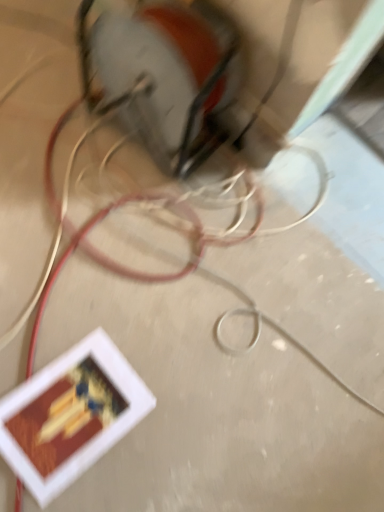
Question: In the image, is matte red wire at lower left positioned in front of or behind metallic silver power plugs and sockets at upper center?

Choices:
 (A) behind
 (B) front

Answer: (B)

Question: Considering the positions of matte red wire at lower left and metallic silver power plugs and sockets at upper center in the image, is matte red wire at lower left taller or shorter than metallic silver power plugs and sockets at upper center?

Choices:
 (A) tall
 (B) short

Answer: (B)

Question: Is point tap(36, 330) closer or farther from the camera than point tap(198, 33)?

Choices:
 (A) closer
 (B) farther

Answer: (B)

Question: In the image, is metallic silver power plugs and sockets at upper center positioned in front of or behind matte red wire at lower left?

Choices:
 (A) front
 (B) behind

Answer: (B)

Question: Based on their sizes in the image, would you say metallic silver power plugs and sockets at upper center is bigger or smaller than matte red wire at lower left?

Choices:
 (A) small
 (B) big

Answer: (A)

Question: Considering the positions of metallic silver power plugs and sockets at upper center and matte red wire at lower left in the image, is metallic silver power plugs and sockets at upper center taller or shorter than matte red wire at lower left?

Choices:
 (A) tall
 (B) short

Answer: (A)

Question: Do you think metallic silver power plugs and sockets at upper center is within matte red wire at lower left, or outside of it?

Choices:
 (A) inside
 (B) outside

Answer: (B)